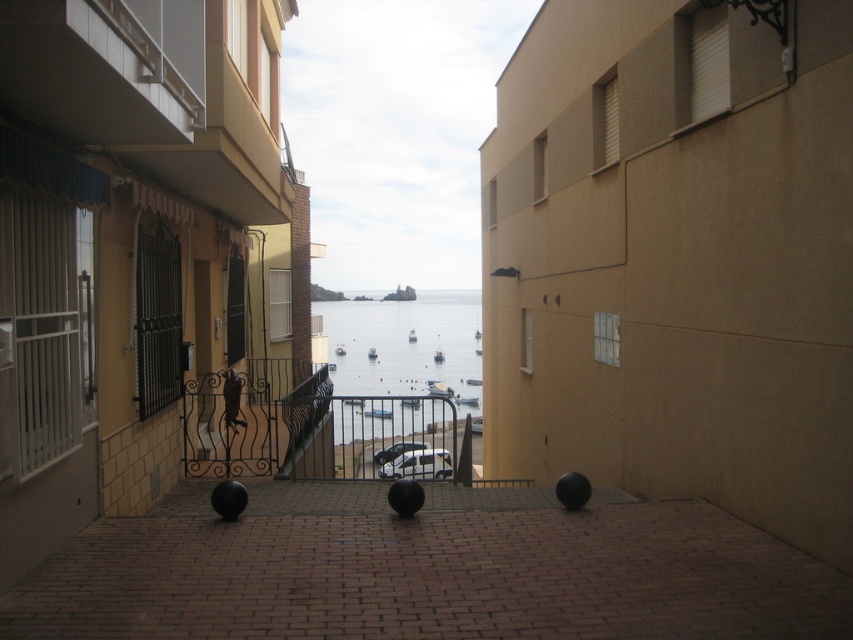
You are a delivery person trying to navigate a narrow alleyway. You need to know which object, the brown brick alley at center or the transparent water at center, is shorter in height. Which one is shorter?

The brown brick alley at center has a lesser height compared to transparent water at center, so the brown brick alley at center is shorter in height.